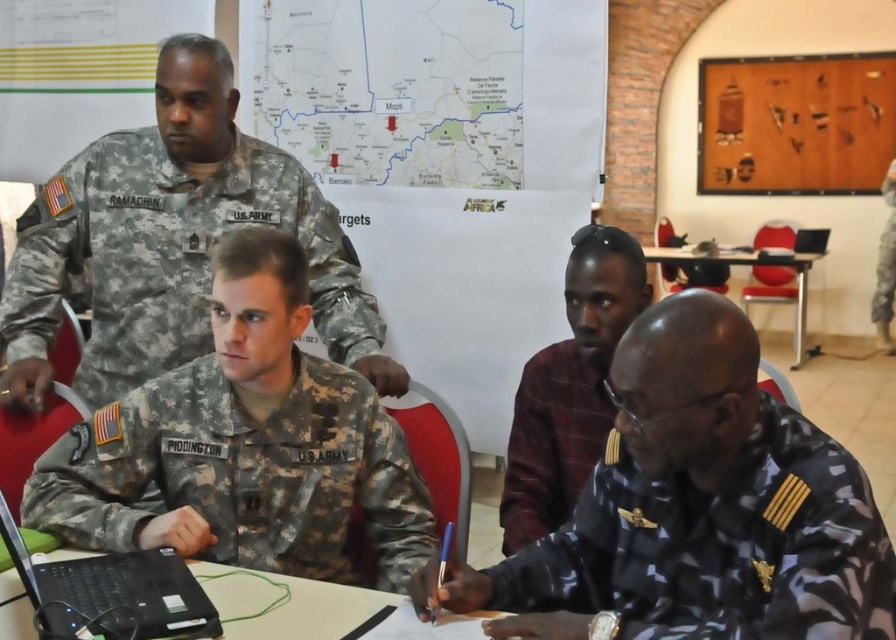
Between navy blue fabric uniform at lower right and camouflage laptop at lower left, which one has more height?

Standing taller between the two is navy blue fabric uniform at lower right.

Is point (533, 378) positioned in front of point (78, 572)?

No.

Between point (539, 435) and point (109, 637), which one is positioned behind?

Positioned behind is point (539, 435).

Where is `navy blue fabric uniform at lower right`? navy blue fabric uniform at lower right is located at coordinates (550, 442).

Does camouflage fabric uniform at center have a smaller size compared to camouflage fabric uniform at upper left?

Yes, camouflage fabric uniform at center is smaller than camouflage fabric uniform at upper left.

Does camouflage fabric uniform at center appear under camouflage fabric uniform at upper left?

Yes, camouflage fabric uniform at center is below camouflage fabric uniform at upper left.

The height and width of the screenshot is (640, 896). What do you see at coordinates (244, 474) in the screenshot?
I see `camouflage fabric uniform at center` at bounding box center [244, 474].

This screenshot has height=640, width=896. I want to click on camouflage fabric uniform at center, so click(x=244, y=474).

Is camouflage fabric uniform at lower right in front of camouflage fabric uniform at upper left?

Yes, camouflage fabric uniform at lower right is in front of camouflage fabric uniform at upper left.

In the scene shown: Is camouflage fabric uniform at lower right wider than camouflage fabric uniform at upper left?

No.

Find the location of a particular element. The width and height of the screenshot is (896, 640). camouflage fabric uniform at lower right is located at coordinates (719, 547).